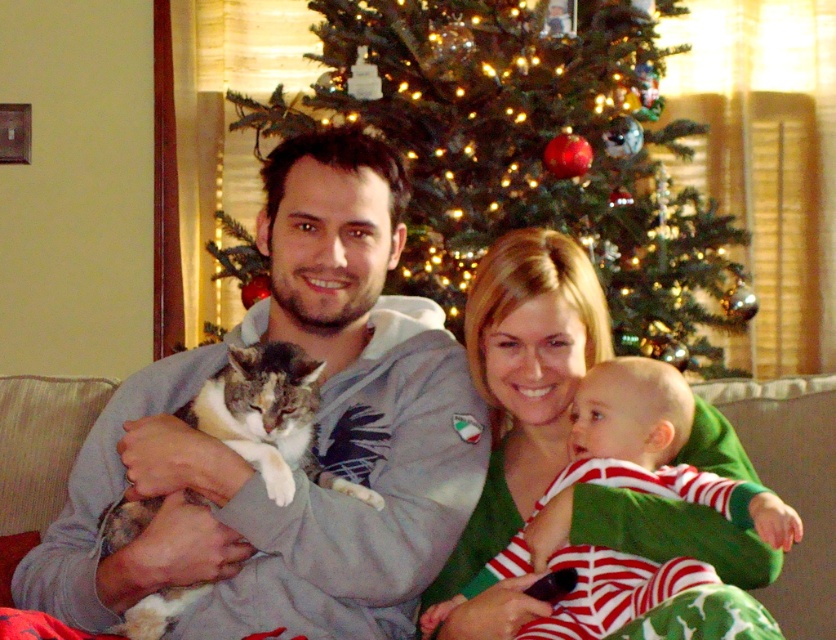
You are a photographer in the living room and want to take a photo of the green textured christmas tree at center and the striped cotton onesie at center. Which object should you focus on first if you want to capture both in the same frame without moving the camera?

The green textured christmas tree at center is positioned on the left side of striped cotton onesie at center. Since the tree is on the left, you should focus on the green textured christmas tree at center first to ensure both objects are in the frame.

You are taking a photo of the living room scene. You want to focus on the point at point (357, 632) and point (373, 58). Which point should you focus on first to ensure both are in focus?

Point (357, 632) is closer to the camera than point (373, 58), so you should focus on point (357, 632) first to ensure both are in focus.

You are a guest in this living room and want to place a small gift between the gray hoodie at center and the green textured christmas tree at center. Based on their positions, which object should you place the gift closer to if you want it near the left side of the room?

Since the gray hoodie at center is to the left of the green textured christmas tree at center, placing the gift closer to the gray hoodie at center would position it nearer to the left side of the room.